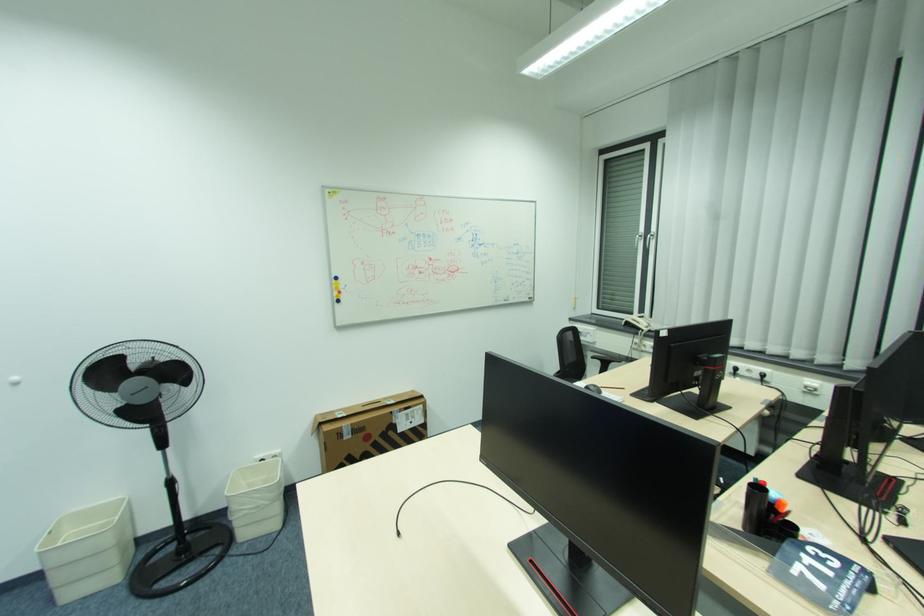
Identify the location of fan control button. (168, 477).